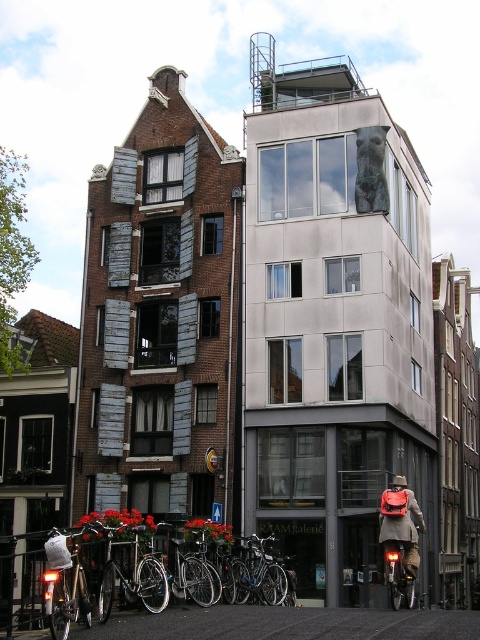
Does silver metallic bicycle at lower left come behind shiny silver bicycle at lower left?

Yes, silver metallic bicycle at lower left is further from the viewer.

At what (x,y) coordinates should I click in order to perform the action: click on silver metallic bicycle at lower left. Please return your answer as a coordinate pair (x, y). Looking at the image, I should click on (100, 577).

Where is `silver metallic bicycle at lower left`? This screenshot has width=480, height=640. silver metallic bicycle at lower left is located at coordinates 100,577.

Is shiny silver bicycle at lower left thinner than matte black backpack at lower right?

Yes, shiny silver bicycle at lower left is thinner than matte black backpack at lower right.

Describe the element at coordinates (64, 582) in the screenshot. The height and width of the screenshot is (640, 480). I see `shiny silver bicycle at lower left` at that location.

Which is in front, point (84, 605) or point (384, 529)?

Point (84, 605)

At what (x,y) coordinates should I click in order to perform the action: click on shiny silver bicycle at lower left. Please return your answer as a coordinate pair (x, y). Looking at the image, I should click on (64, 582).

Is silver metallic bicycle at lower left shorter than shiny metallic bicycle at lower right?

Yes.

Is point (143, 596) positioned in front of point (399, 602)?

Yes, it is in front of point (399, 602).

Which is in front, point (54, 611) or point (404, 557)?

Point (54, 611) is more forward.

Where is `silver metallic bicycle at lower left`? The height and width of the screenshot is (640, 480). silver metallic bicycle at lower left is located at coordinates (100, 577).